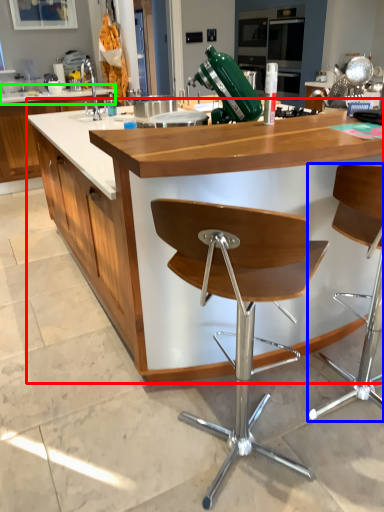
Question: Which object is positioned farthest from countertop (highlighted by a red box)? Select from chair (highlighted by a blue box) and countertop (highlighted by a green box).

Choices:
 (A) chair
 (B) countertop

Answer: (B)